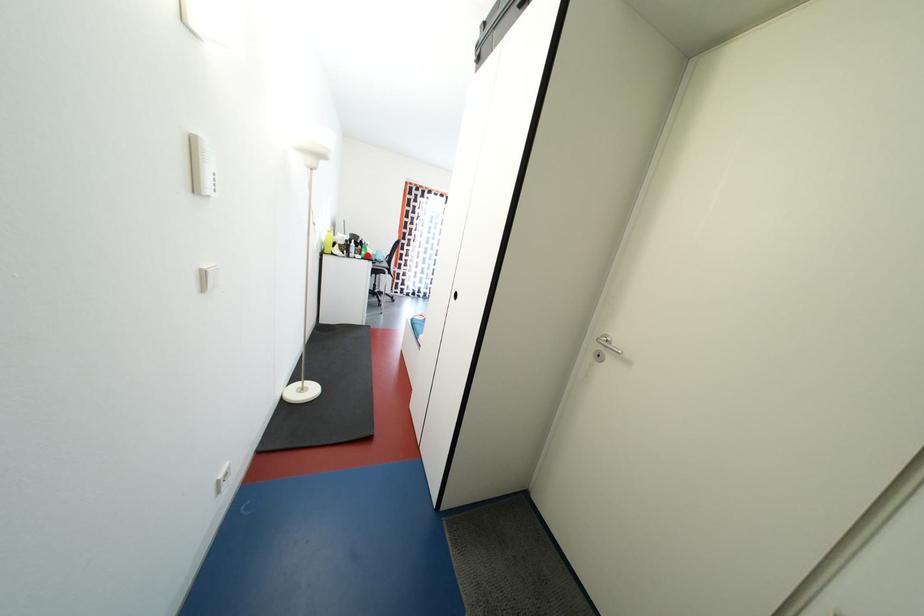
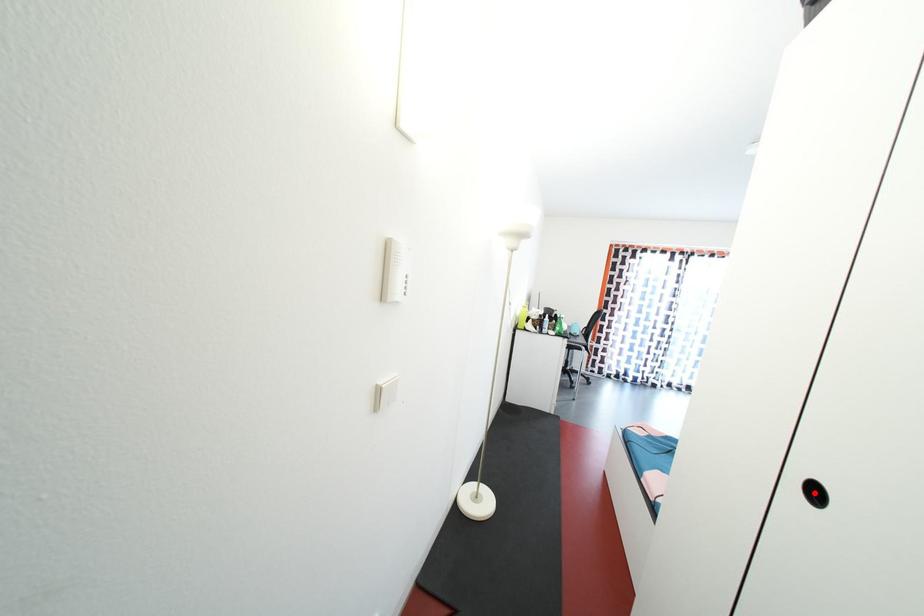
I am providing you with two images of the same scene from different viewpoints. A red point is marked on the first image and another point is marked on the second image. Do the highlighted points in image1 and image2 indicate the same real-world spot?

No